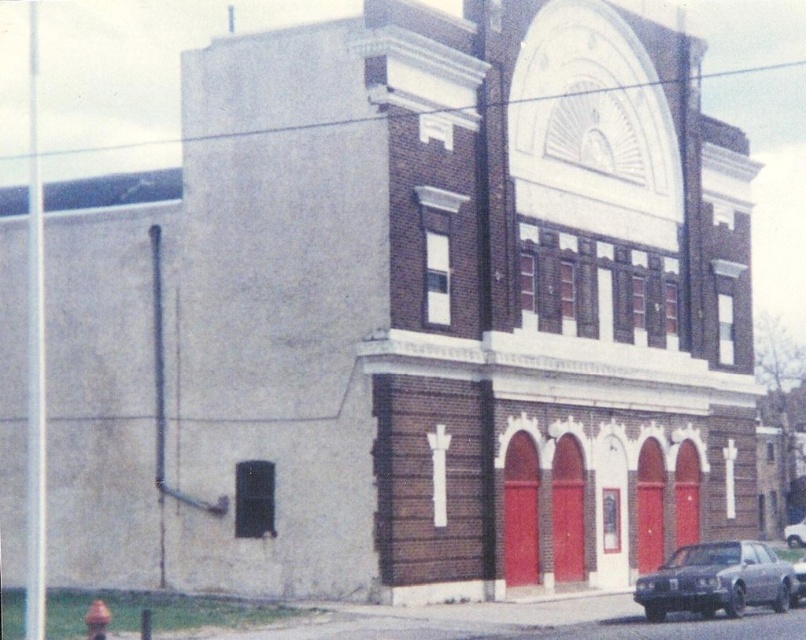
Question: Which of the following is the closest to the observer?

Choices:
 (A) green rubber fire hydrant at lower left
 (B) metallic gray sedan at lower right
 (C) shiny silver car at lower right

Answer: (A)

Question: Is green rubber fire hydrant at lower left below shiny silver car at lower right?

Choices:
 (A) no
 (B) yes

Answer: (A)

Question: Does metallic gray sedan at lower right appear under shiny silver car at lower right?

Choices:
 (A) no
 (B) yes

Answer: (A)

Question: Which point appears farthest from the camera in this image?

Choices:
 (A) (804, 545)
 (B) (750, 556)
 (C) (86, 621)

Answer: (A)

Question: Which of the following is the farthest from the observer?

Choices:
 (A) (788, 545)
 (B) (780, 577)

Answer: (A)

Question: Is green rubber fire hydrant at lower left wider than shiny silver car at lower right?

Choices:
 (A) no
 (B) yes

Answer: (B)